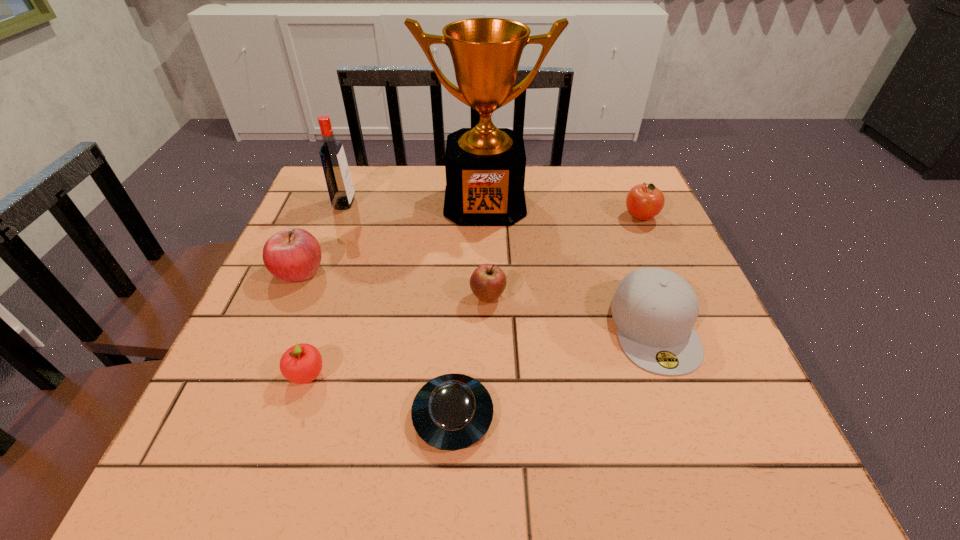
Choose which object is the fifth nearest neighbor to the trophy cup. Please provide its 2D coordinates. Your answer should be formatted as a tuple, i.e. [(x, y)], where the tuple contains the x and y coordinates of a point satisfying the conditions above.

[(655, 309)]

This screenshot has height=540, width=960. Find the location of `apple that stands as the second closest to the rightmost apple`. apple that stands as the second closest to the rightmost apple is located at coordinates (293, 255).

I want to click on apple object that ranks as the second closest to the leftmost apple, so click(x=488, y=281).

Locate an element on the screen. Image resolution: width=960 pixels, height=540 pixels. vacant position in the image that satisfies the following two spatial constraints: 1. on the front and back of the seventh shortest object; 2. on the right side of the nearest apple is located at coordinates (278, 374).

Locate an element on the screen. vacant space that satisfies the following two spatial constraints: 1. on the front of the trophy cup with the label; 2. on the right side of the farthest apple is located at coordinates [485, 217].